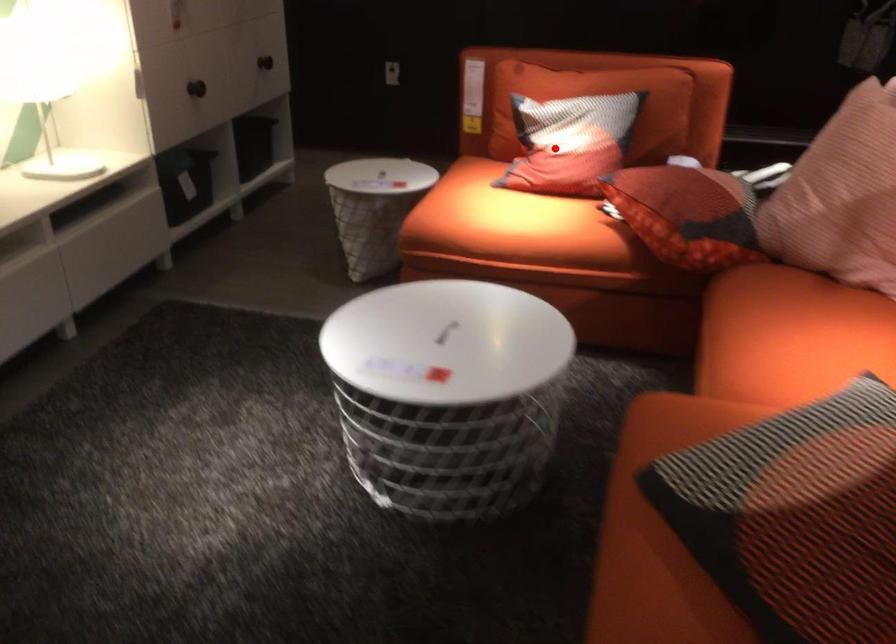
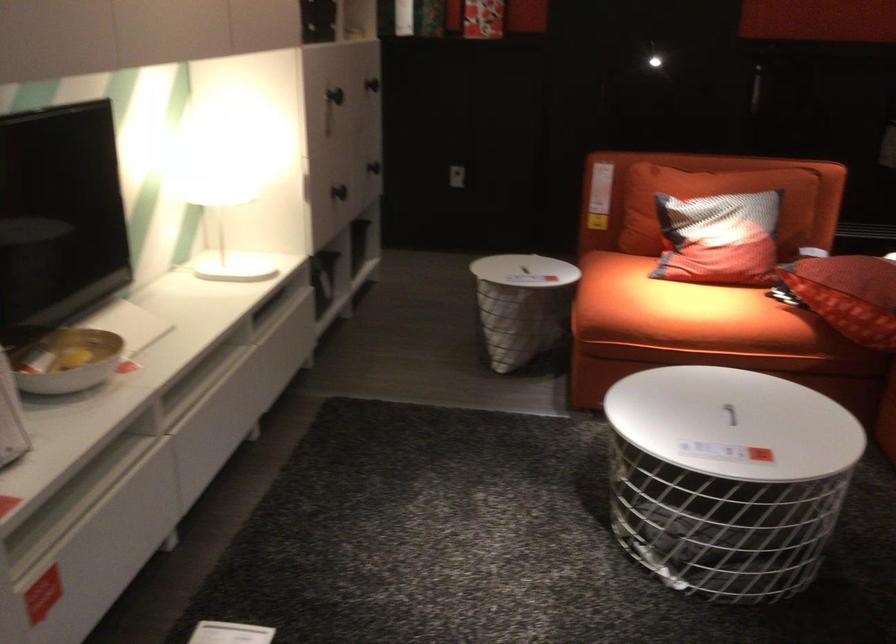
Locate, in the second image, the point that corresponds to the highlighted location in the first image.

(719, 239)